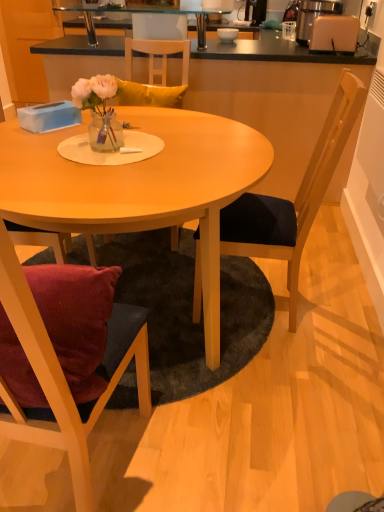
Locate an element on the screen. spots to the right of wooden chair at upper center is located at coordinates (198, 45).